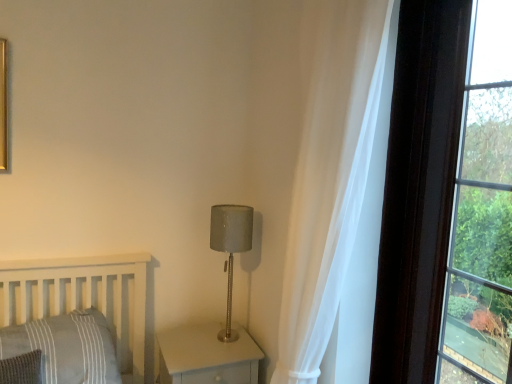
The width and height of the screenshot is (512, 384). Find the location of `dark brown wood frame at right`. dark brown wood frame at right is located at coordinates (448, 199).

I want to click on gray striped pillow at lower left, so click(67, 347).

Image resolution: width=512 pixels, height=384 pixels. What do you see at coordinates (207, 356) in the screenshot?
I see `matte gray wood nightstand at lower center` at bounding box center [207, 356].

This screenshot has height=384, width=512. In order to click on dark brown wood frame at right in this screenshot , I will do `click(448, 199)`.

From a real-world perspective, is gray striped pillow at lower left above or below white sheer curtain at right?

gray striped pillow at lower left is below white sheer curtain at right.

Is point (62, 336) closer to camera compared to point (340, 209)?

No.

In the scene shown: Can you see gray striped pillow at lower left touching white sheer curtain at right?

gray striped pillow at lower left and white sheer curtain at right are clearly separated.

Considering the sizes of objects gray striped pillow at lower left and white sheer curtain at right in the image provided, who is taller, gray striped pillow at lower left or white sheer curtain at right?

white sheer curtain at right is taller.

Does dark brown wood frame at right have a lesser height compared to satin gray lampshade at center?

Incorrect, the height of dark brown wood frame at right does not fall short of that of satin gray lampshade at center.

Is satin gray lampshade at center located within dark brown wood frame at right?

No, satin gray lampshade at center is not a part of dark brown wood frame at right.

From a real-world perspective, which object rests below the other?

satin gray lampshade at center.

Is gray striped pillow at lower left beside matte gray wood nightstand at lower center?

There is a gap between gray striped pillow at lower left and matte gray wood nightstand at lower center.

Which object is further away from the camera, gray striped pillow at lower left or matte gray wood nightstand at lower center?

Positioned behind is matte gray wood nightstand at lower center.

The image size is (512, 384). I want to click on nightstand that appears below the gray striped pillow at lower left (from the image's perspective), so click(207, 356).

Are dark brown wood frame at right and gray striped pillow at lower left making contact?

No.

Is dark brown wood frame at right positioned with its back to gray striped pillow at lower left?

No, dark brown wood frame at right is not facing the opposite direction of gray striped pillow at lower left.

Which object is wider, dark brown wood frame at right or gray striped pillow at lower left?

gray striped pillow at lower left is wider.

Based on the photo, how different are the orientations of dark brown wood frame at right and gray striped pillow at lower left in degrees?

92.5 degrees.

From a real-world perspective, relative to white sheer curtain at right, is satin gray lampshade at center vertically above or below?

Clearly, from a real-world perspective, satin gray lampshade at center is below white sheer curtain at right.

Is satin gray lampshade at center outside of white sheer curtain at right?

Yes, satin gray lampshade at center is outside of white sheer curtain at right.

Which object is thinner, satin gray lampshade at center or white sheer curtain at right?

With smaller width is satin gray lampshade at center.

Does point (245, 210) lie behind point (368, 119)?

Yes, point (245, 210) is farther from viewer.

Which of these two, satin gray lampshade at center or matte gray wood nightstand at lower center, is wider?

Wider between the two is matte gray wood nightstand at lower center.

Measure the distance between satin gray lampshade at center and matte gray wood nightstand at lower center.

satin gray lampshade at center is 18.85 inches from matte gray wood nightstand at lower center.

Is point (227, 302) positioned behind point (217, 358)?

Yes, it is behind point (217, 358).

Which of these two, matte gray wood nightstand at lower center or dark brown wood frame at right, stands taller?

dark brown wood frame at right is taller.

Is matte gray wood nightstand at lower center oriented towards dark brown wood frame at right?

No, matte gray wood nightstand at lower center is not facing towards dark brown wood frame at right.

Considering the positions of objects matte gray wood nightstand at lower center and dark brown wood frame at right in the image provided, who is in front, matte gray wood nightstand at lower center or dark brown wood frame at right?

dark brown wood frame at right is in front.

Find the location of a particular element. This screenshot has height=384, width=512. pillow that is under the white sheer curtain at right (from a real-world perspective) is located at coordinates (67, 347).

Locate an element on the screen. window on the right of satin gray lampshade at center is located at coordinates (448, 199).

Which object lies nearer to the anchor point white sheer curtain at right, satin gray lampshade at center or dark brown wood frame at right?

dark brown wood frame at right lies closer to white sheer curtain at right than the other object.

Based on their spatial positions, is satin gray lampshade at center or matte gray wood nightstand at lower center further from white sheer curtain at right?

matte gray wood nightstand at lower center.

Considering their positions, is white sheer curtain at right positioned closer to satin gray lampshade at center than matte gray wood nightstand at lower center?

matte gray wood nightstand at lower center is positioned closer to the anchor satin gray lampshade at center.

When comparing their distances from matte gray wood nightstand at lower center, does gray striped pillow at lower left or dark brown wood frame at right seem further?

dark brown wood frame at right is further to matte gray wood nightstand at lower center.

In the scene shown: Considering their positions, is matte gray wood nightstand at lower center positioned further to satin gray lampshade at center than dark brown wood frame at right?

Based on the image, dark brown wood frame at right appears to be further to satin gray lampshade at center.

Which object lies further to the anchor point satin gray lampshade at center, dark brown wood frame at right or matte gray wood nightstand at lower center?

Based on the image, dark brown wood frame at right appears to be further to satin gray lampshade at center.

When comparing their distances from dark brown wood frame at right, does matte gray wood nightstand at lower center or gray striped pillow at lower left seem closer?

matte gray wood nightstand at lower center lies closer to dark brown wood frame at right than the other object.

From the image, which object appears to be nearer to dark brown wood frame at right, gray striped pillow at lower left or satin gray lampshade at center?

satin gray lampshade at center is closer to dark brown wood frame at right.

This screenshot has width=512, height=384. I want to click on nightstand between gray striped pillow at lower left and dark brown wood frame at right, so click(x=207, y=356).

At what (x,y) coordinates should I click in order to perform the action: click on nightstand between gray striped pillow at lower left and satin gray lampshade at center. Please return your answer as a coordinate pair (x, y). Looking at the image, I should click on tap(207, 356).

The height and width of the screenshot is (384, 512). I want to click on nightstand positioned between white sheer curtain at right and satin gray lampshade at center from near to far, so click(x=207, y=356).

What are the coordinates of `curtain situated between gray striped pillow at lower left and dark brown wood frame at right from left to right` in the screenshot? It's located at (331, 176).